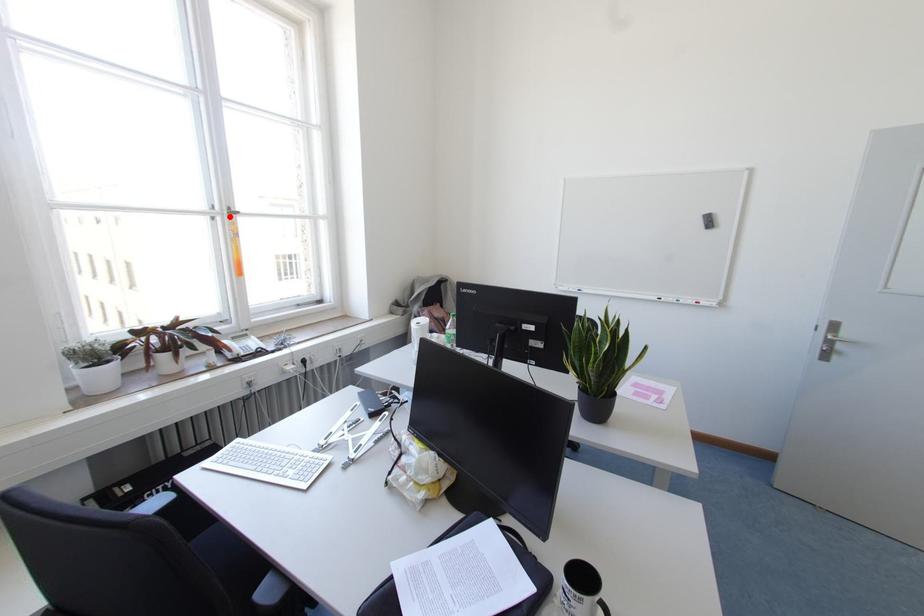
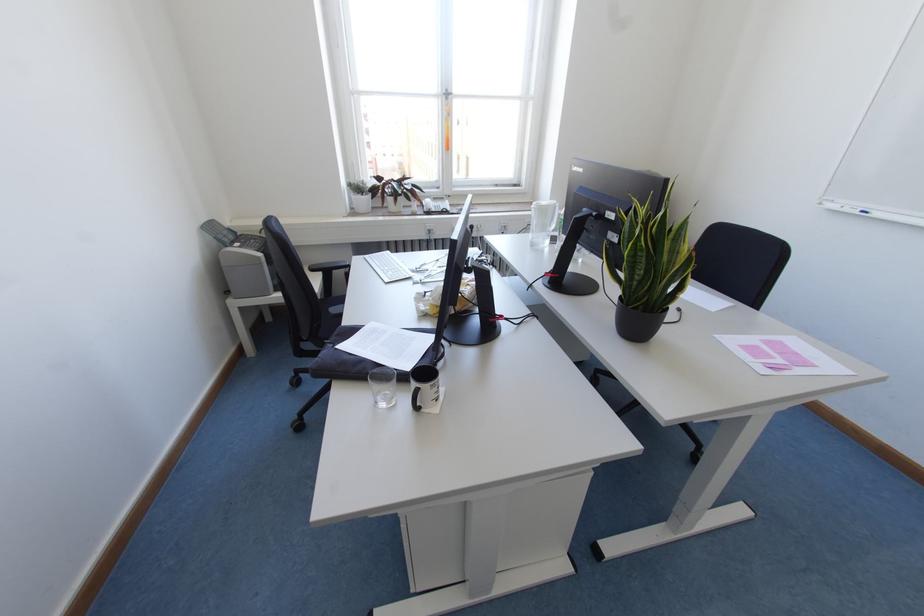
Locate, in the second image, the point that corresponds to the highlighted location in the first image.

(446, 98)